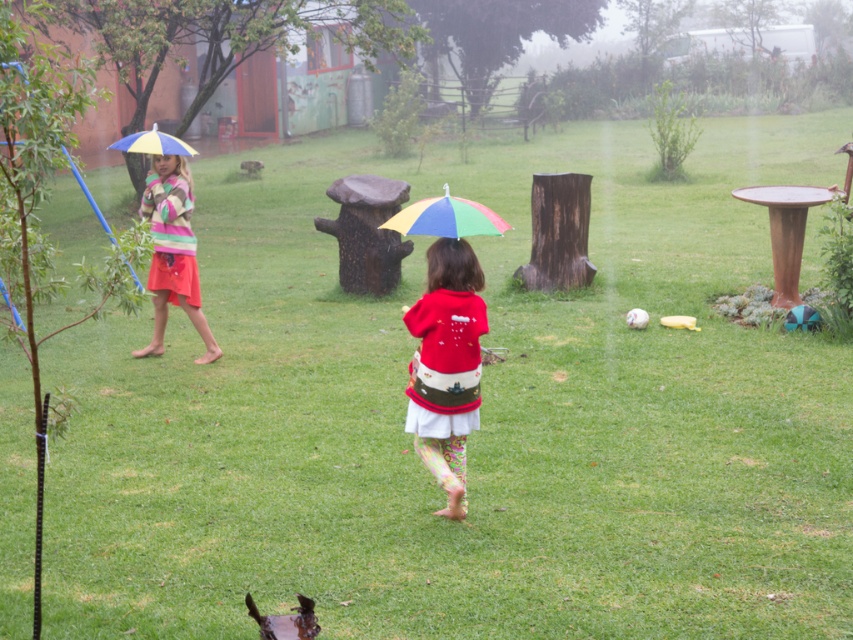
Between point (415, 221) and point (137, 132), which one is positioned in front?

Point (415, 221)

Is point (430, 205) positioned behind point (175, 138)?

That is False.

The image size is (853, 640). What do you see at coordinates (445, 218) in the screenshot? I see `rainbow fabric umbrella at center` at bounding box center [445, 218].

Where is `rainbow fabric umbrella at center`? rainbow fabric umbrella at center is located at coordinates (445, 218).

Which is above, striped knit sweater at left or rainbow fabric umbrella at center?

rainbow fabric umbrella at center

Does striped knit sweater at left come in front of rainbow fabric umbrella at center?

No, it is not.

Is point (180, 284) more distant than point (419, 209)?

That is True.

The height and width of the screenshot is (640, 853). What are the coordinates of `striped knit sweater at left` in the screenshot? It's located at (172, 253).

This screenshot has height=640, width=853. What do you see at coordinates (445, 365) in the screenshot? I see `matte red sweater at center` at bounding box center [445, 365].

Is matte red sweater at center to the left of striped knit sweater at left from the viewer's perspective?

Incorrect, matte red sweater at center is not on the left side of striped knit sweater at left.

Who is more forward, [468,328] or [207,362]?

Positioned in front is point [468,328].

This screenshot has width=853, height=640. I want to click on matte red sweater at center, so click(445, 365).